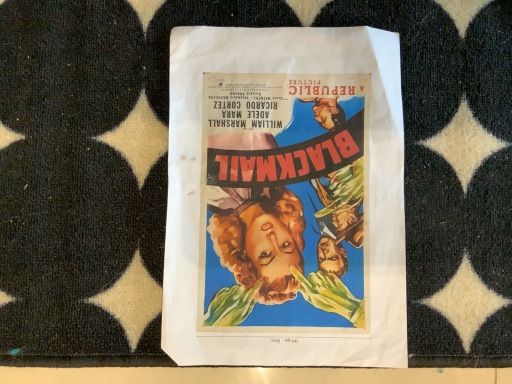
The image size is (512, 384). I want to click on free space above vibrant paper poster at center (from a real-world perspective), so click(x=288, y=187).